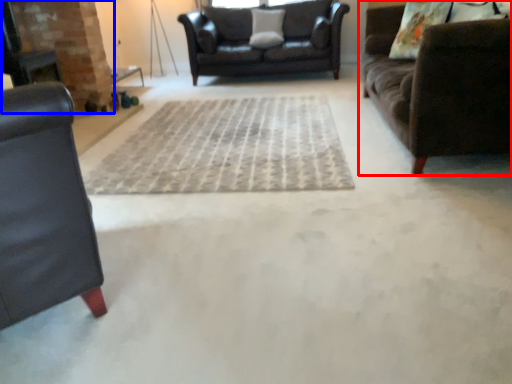
Question: Among these objects, which one is nearest to the camera, studio couch (highlighted by a red box) or fireplace (highlighted by a blue box)?

Choices:
 (A) studio couch
 (B) fireplace

Answer: (A)